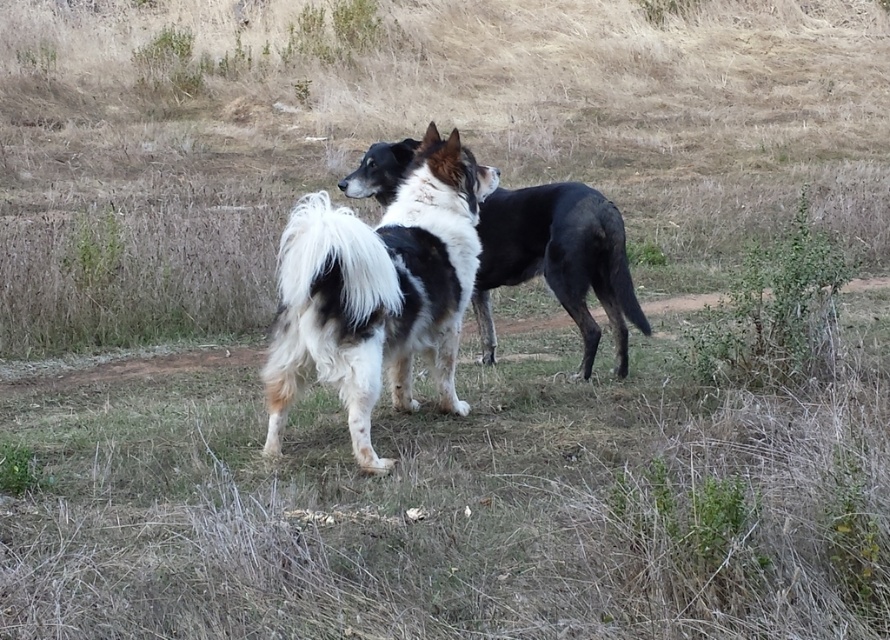
In the scene shown: You are a photographer trying to capture both the brown dry grass at center and the white fluffy dog at center in the same frame. Given that your camera has a 50mm lens with a depth of field that can focus on objects within 18 inches of each other, will both subjects be in focus?

The brown dry grass at center and white fluffy dog at center are 20.67 inches apart, which exceeds the 18 inch depth of field range. Therefore, both subjects cannot be in focus simultaneously with the current settings.

You are a photographer setting up a tripod in the middle of the grassy field where the two dogs are standing. You want to capture both dogs in a single frame without moving them. Since the white fluffy dog at center is wider than the black and white fur dog at center, will you need to adjust the camera angle to include both dogs in the frame?

The white fluffy dog at center is wider than the black and white fur dog at center, so you will need to adjust the camera angle to ensure both dogs are fully captured in the frame.

You are a dog trainer trying to separate two dogs in a field. You have a leash that is 18 inches long. You see the white fluffy dog at center and the black and white fur dog at center. Can you safely leash both dogs together without them getting tangled?

The distance between the white fluffy dog at center and the black and white fur dog at center is 18.50 inches. Since the leash is only 18 inches long, it is too short to connect both dogs without them getting tangled.